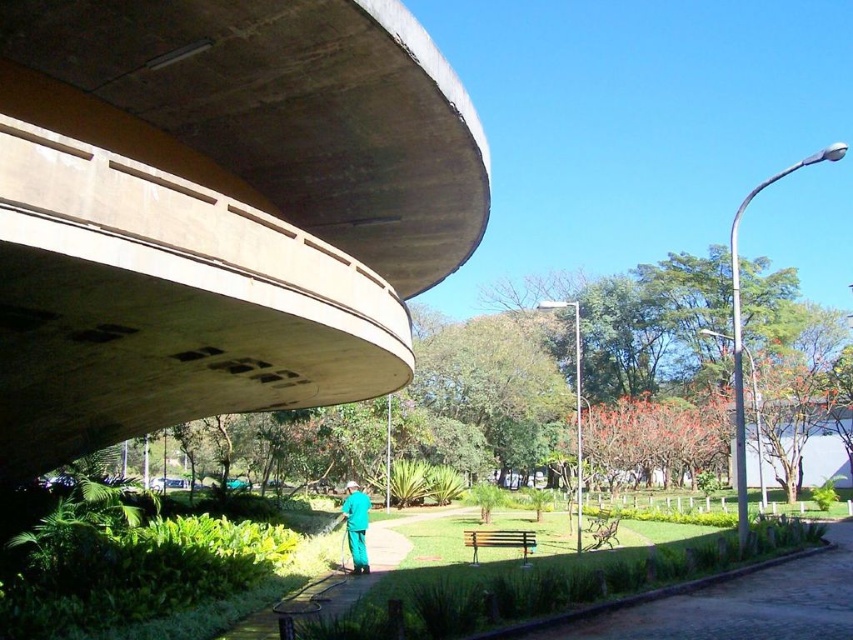
You are planning to set up a picnic in the park shown in the image. You have a picnic blanket that is 2 meters wide. The green grass at lower center and the green matte uniform at center are both potential spots. Based on their widths, which location would accommodate your blanket more comfortably?

The green grass at lower center has a larger width than the green matte uniform at center, so it would accommodate the 2 meter wide picnic blanket more comfortably.

You are standing at the center of the park and looking towards the curved concrete structure. Which direction should you move to get closer to the concrete at upper left represented by point (218, 211)?

The concrete at upper left is located at point (218, 211), so you should move towards the upper left direction to get closer to it.

You are planning to set up a picnic in this park. You have a large blanket that can cover the area of the larger object between the concrete at upper left and the green grass at lower center. Which area should you choose to ensure your blanket fits properly?

The concrete at upper left is larger in size than the green grass at lower center, so you should choose the concrete at upper left to ensure your blanket fits properly.